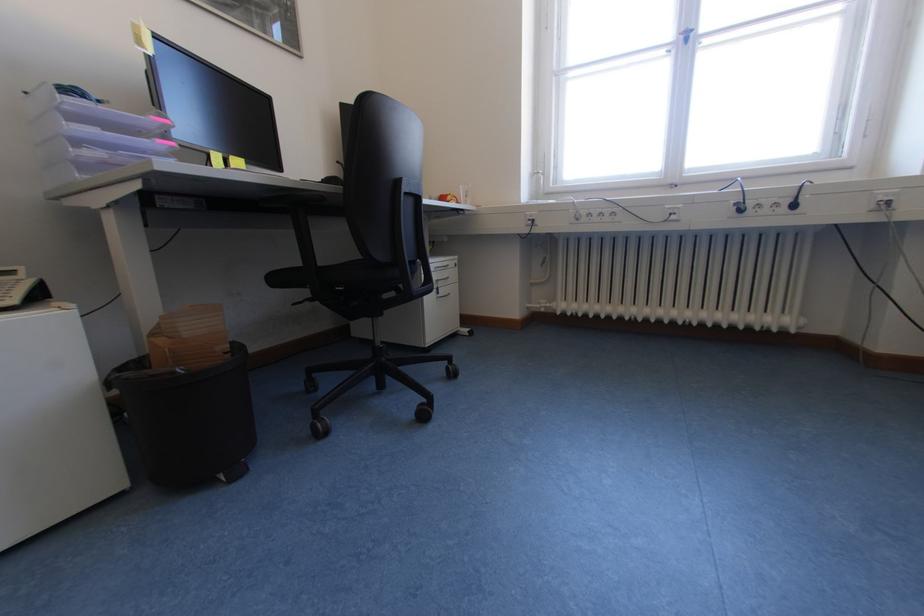
Where would you pull the clear paper tray? Please return your answer as a coordinate pair (x, y).

(90, 136)